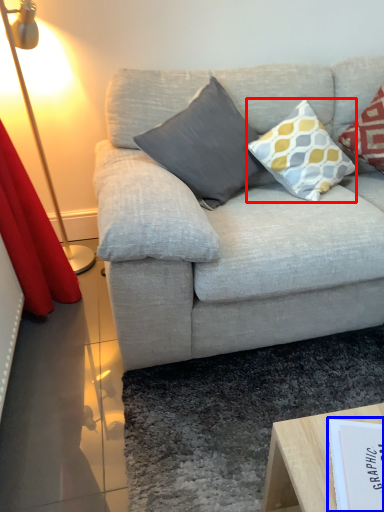
Question: Which of the following is the farthest to the observer, pillow (highlighted by a red box) or paperback book (highlighted by a blue box)?

Choices:
 (A) pillow
 (B) paperback book

Answer: (A)